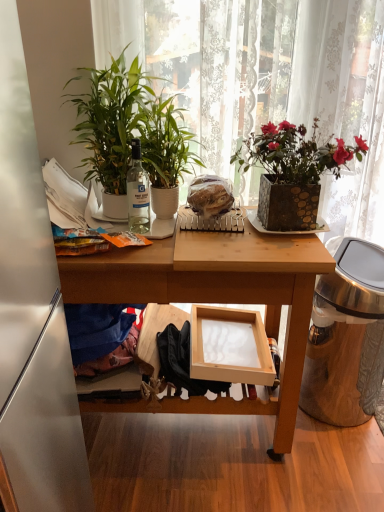
Find the location of a particular element. This screenshot has width=384, height=512. unoccupied area in front of translucent plastic bread at center is located at coordinates (218, 237).